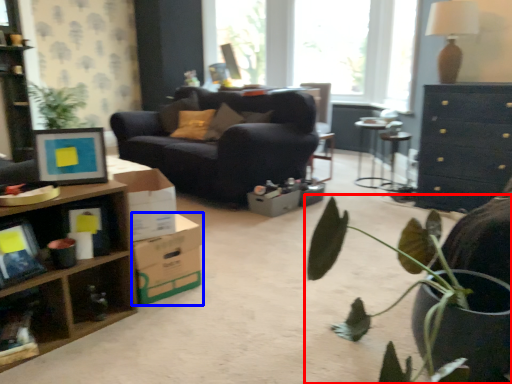
Question: Which point is closer to the camera, houseplant (highlighted by a red box) or cardboard box (highlighted by a blue box)?

Choices:
 (A) houseplant
 (B) cardboard box

Answer: (A)